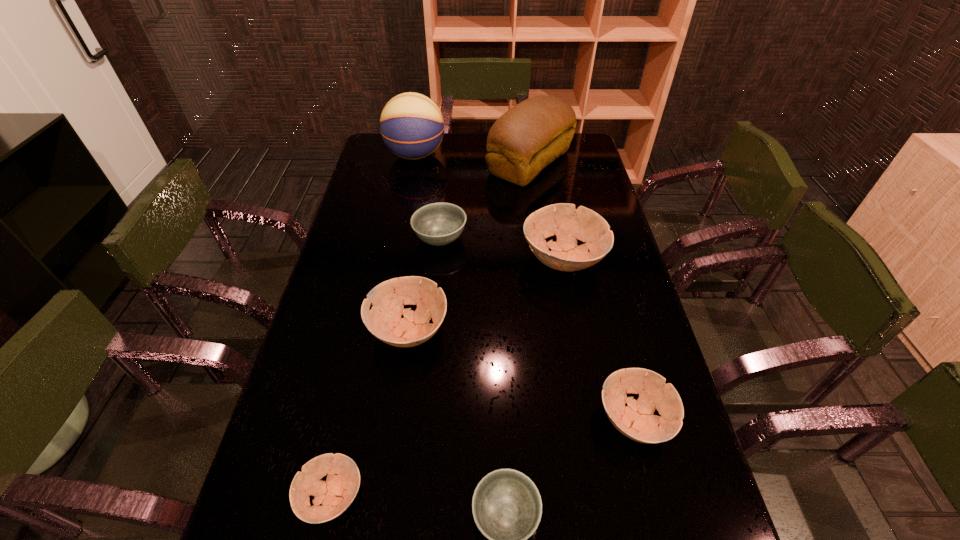
Where is `basketball positioned at the left edge`? This screenshot has width=960, height=540. basketball positioned at the left edge is located at coordinates (412, 127).

This screenshot has height=540, width=960. In order to click on bread located in the right edge section of the desktop in this screenshot , I will do `click(534, 133)`.

At what (x,y) coordinates should I click in order to perform the action: click on object at the far left corner. Please return your answer as a coordinate pair (x, y). Image resolution: width=960 pixels, height=540 pixels. Looking at the image, I should click on (412, 127).

I want to click on object that is at the far right corner, so click(534, 133).

At what (x,y) coordinates should I click in order to perform the action: click on free space at the far edge of the desktop. Please return your answer as a coordinate pair (x, y). Looking at the image, I should click on click(x=486, y=135).

In the image, there is a desktop. Find the location of `vacant area at the left edge`. vacant area at the left edge is located at coordinates (332, 330).

In the image, there is a desktop. At what (x,y) coordinates should I click in order to perform the action: click on vacant space at the right edge. Please return your answer as a coordinate pair (x, y). Looking at the image, I should click on (563, 177).

I want to click on free location at the far left corner, so click(396, 162).

Where is `free space between the basketball and the third smallest brown bowl`? Image resolution: width=960 pixels, height=540 pixels. free space between the basketball and the third smallest brown bowl is located at coordinates (412, 242).

Identify the location of unoccupied area between the basketball and the left gray bowl. (428, 197).